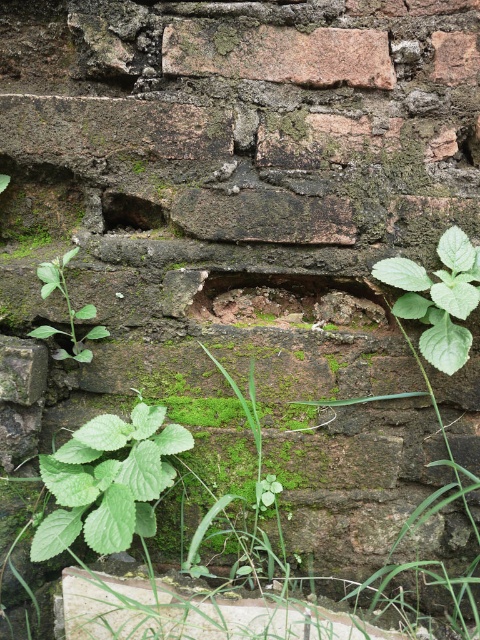
You are a muralist planning to paint a small circular design on the aged brick wall. The design must be centered exactly at the coordinates provided for the rusty stone brick at upper center. What are the coordinates where you should position the center of your design?

The coordinates for the rusty stone brick at upper center are given as point (277, 52), so you should position the center of your design at those exact coordinates.

You are standing in front of the aged brick wall. Where is the green leafy plant at lower left located?

The green leafy plant at lower left is located at point (108, 481).

From the picture: You are standing in front of the aged brick wall and want to touch both points on the wall. Which point, point (x=307, y=33) or point (x=72, y=308), will require you to reach further out to touch?

Point (x=72, y=308) requires reaching further because it is farther from the camera compared to point (x=307, y=33).